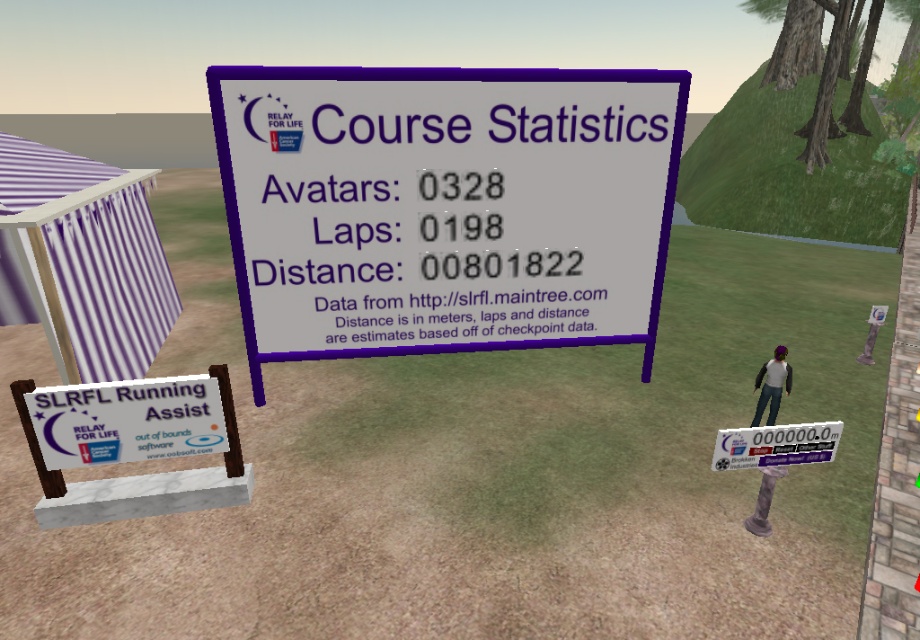
Question: Where is purple glossy sign at center located in relation to denim jeans at center in the image?

Choices:
 (A) above
 (B) below

Answer: (B)

Question: Which point appears farthest from the camera in this image?

Choices:
 (A) (77, 346)
 (B) (785, 452)
 (C) (536, 266)

Answer: (B)

Question: In this image, where is purple striped canopy at left located relative to purple glossy sign at center?

Choices:
 (A) below
 (B) above

Answer: (B)

Question: Which object is positioned closest to the denim jeans at center?

Choices:
 (A) white paper sign at center
 (B) purple glossy sign at center

Answer: (B)

Question: Is purple striped canopy at left to the left of denim jeans at center from the viewer's perspective?

Choices:
 (A) yes
 (B) no

Answer: (A)

Question: Which object appears closest to the camera in this image?

Choices:
 (A) purple striped canopy at left
 (B) purple glossy sign at center

Answer: (A)